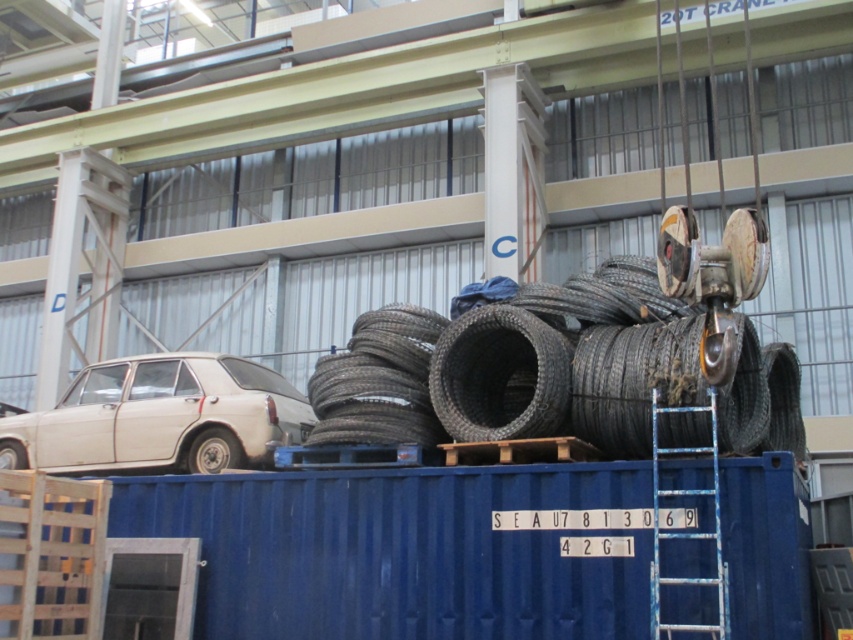
Between dark gray rubber tire at center and blue metallic ladder at right, which one is positioned higher?

dark gray rubber tire at center

Describe the element at coordinates (500, 376) in the screenshot. I see `dark gray rubber tire at center` at that location.

Image resolution: width=853 pixels, height=640 pixels. In order to click on dark gray rubber tire at center in this screenshot , I will do `click(500, 376)`.

Between point (640, 346) and point (222, 461), which one is positioned behind?

Positioned behind is point (222, 461).

Describe the element at coordinates (633, 381) in the screenshot. I see `black rubber tire at center` at that location.

Who is more distant from viewer, (621, 410) or (236, 461)?

Positioned behind is point (236, 461).

The width and height of the screenshot is (853, 640). In order to click on black rubber tire at center in this screenshot , I will do `click(633, 381)`.

Does dark gray rubber tire at center appear on the right side of black rubber tire at lower left?

Yes, dark gray rubber tire at center is to the right of black rubber tire at lower left.

Can you confirm if dark gray rubber tire at center is bigger than black rubber tire at lower left?

Correct, dark gray rubber tire at center is larger in size than black rubber tire at lower left.

Who is more distant from viewer, [515,332] or [213,470]?

The point [213,470] is more distant.

Locate an element on the screen. dark gray rubber tire at center is located at coordinates (500, 376).